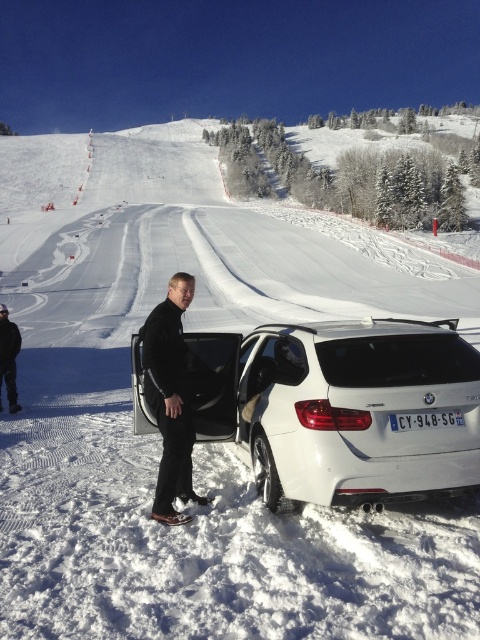
Question: Is white matte car at center positioned at the back of black softshell jacket at center?

Choices:
 (A) no
 (B) yes

Answer: (A)

Question: Is white matte car at center below black softshell jacket at center?

Choices:
 (A) yes
 (B) no

Answer: (A)

Question: Is white matte car at center to the left of black softshell jacket at center from the viewer's perspective?

Choices:
 (A) no
 (B) yes

Answer: (A)